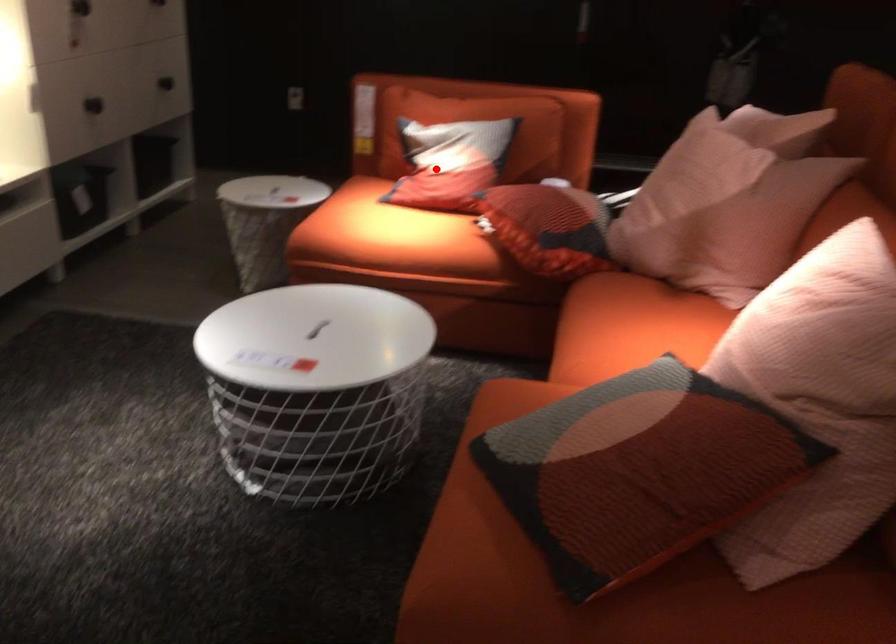
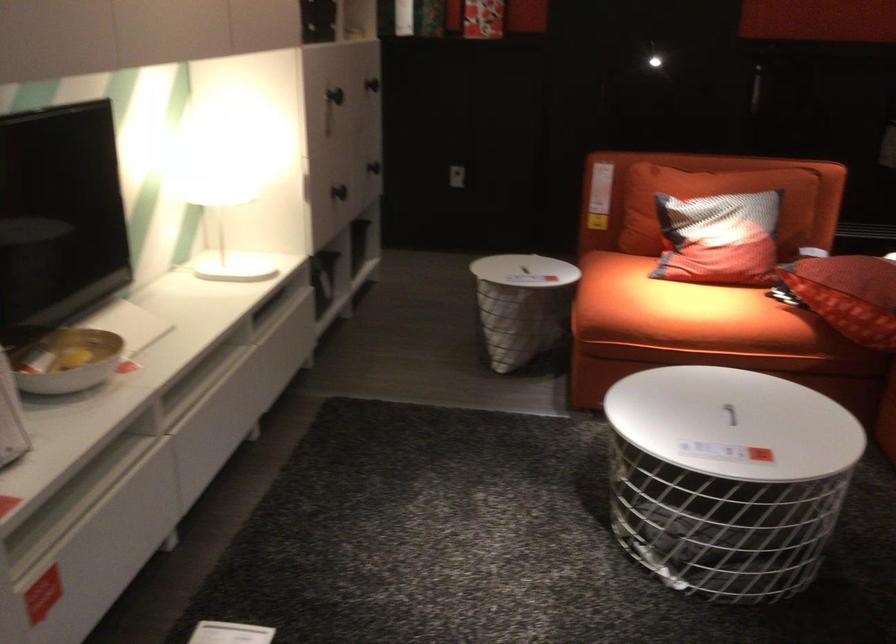
Where in the second image is the point corresponding to the highlighted location from the first image?

(719, 239)